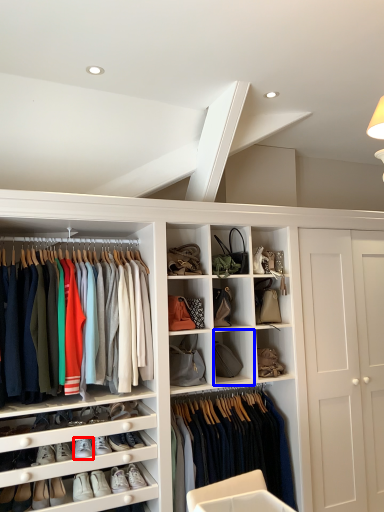
Question: Which object is closer to the camera taking this photo, footwear (highlighted by a red box) or cabinet (highlighted by a blue box)?

Choices:
 (A) footwear
 (B) cabinet

Answer: (A)